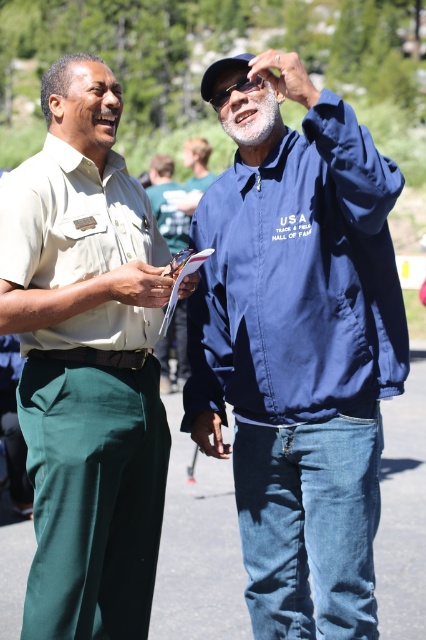
Question: Is matte khaki shirt at left above blue matte jacket at center?

Choices:
 (A) yes
 (B) no

Answer: (A)

Question: Which point is closer to the camera taking this photo?

Choices:
 (A) (77, 204)
 (B) (175, 205)
 (C) (253, 77)

Answer: (C)

Question: Can you confirm if blue fabric jacket at upper right is bigger than matte khaki shirt at left?

Choices:
 (A) yes
 (B) no

Answer: (A)

Question: Can you confirm if blue fabric jacket at upper right is positioned below blue matte jacket at center?

Choices:
 (A) no
 (B) yes

Answer: (A)

Question: Which of the following is the closest to the observer?

Choices:
 (A) (77, 396)
 (B) (160, 196)
 (C) (296, 480)

Answer: (C)

Question: Among these objects, which one is nearest to the camera?

Choices:
 (A) blue matte jacket at center
 (B) matte khaki shirt at left

Answer: (B)